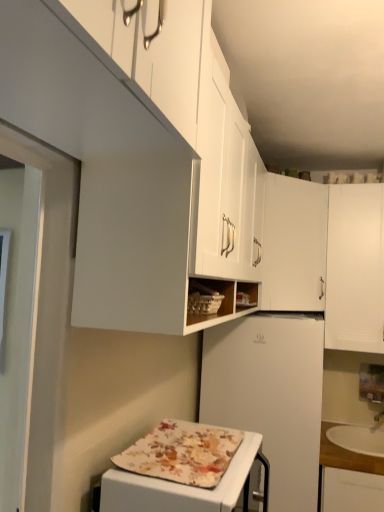
Question: Does white matte refrigerator at center have a greater width compared to white matte cabinet at upper center, placed as the 1th cabinetry when sorted from left to right?

Choices:
 (A) yes
 (B) no

Answer: (A)

Question: From the image's perspective, would you say white matte refrigerator at center is positioned over white matte cabinet at upper center, placed as the 1th cabinetry when sorted from left to right?

Choices:
 (A) yes
 (B) no

Answer: (B)

Question: Would you say white matte cabinet at upper center, placed as the 1th cabinetry when sorted from left to right, is part of white matte refrigerator at center's contents?

Choices:
 (A) yes
 (B) no

Answer: (B)

Question: Is white matte refrigerator at center positioned beyond the bounds of white matte cabinet at upper center, placed as the 1th cabinetry when sorted from left to right?

Choices:
 (A) no
 (B) yes

Answer: (B)

Question: Can you confirm if white matte refrigerator at center is thinner than white matte cabinet at upper center, placed as the 1th cabinetry when sorted from left to right?

Choices:
 (A) yes
 (B) no

Answer: (B)

Question: Is white matte refrigerator at center facing towards white matte cabinet at upper center, which appears as the third cabinetry when viewed from the right?

Choices:
 (A) no
 (B) yes

Answer: (A)

Question: From a real-world perspective, is white matte cabinet at upper center, the 2th cabinetry from the right, below wooden countertop at lower right?

Choices:
 (A) no
 (B) yes

Answer: (A)

Question: From the image's perspective, is white matte cabinet at upper center, the 2th cabinetry positioned from the left, beneath wooden countertop at lower right?

Choices:
 (A) no
 (B) yes

Answer: (A)

Question: Does white matte cabinet at upper center, the 2th cabinetry positioned from the left, appear on the right side of wooden countertop at lower right?

Choices:
 (A) yes
 (B) no

Answer: (B)

Question: Would you say wooden countertop at lower right is part of white matte cabinet at upper center, the 2th cabinetry from the right,'s contents?

Choices:
 (A) yes
 (B) no

Answer: (B)

Question: Is white matte cabinet at upper center, the 2th cabinetry from the right, thinner than wooden countertop at lower right?

Choices:
 (A) no
 (B) yes

Answer: (B)

Question: Could you tell me if white matte cabinet at upper center, the 2th cabinetry from the right, is facing wooden countertop at lower right?

Choices:
 (A) no
 (B) yes

Answer: (A)

Question: Can you confirm if white matte refrigerator at center is positioned to the right of white matte cabinet at upper right, which is the 1th cabinetry from right to left?

Choices:
 (A) no
 (B) yes

Answer: (A)